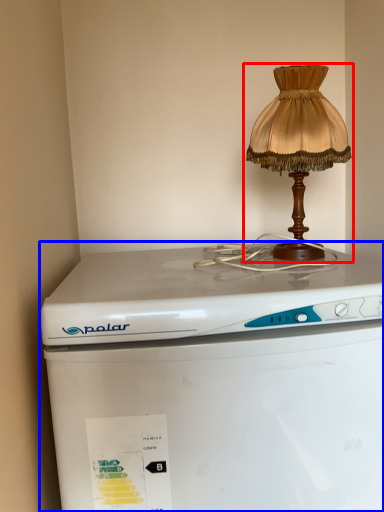
Question: Which object is closer to the camera taking this photo, lamp (highlighted by a red box) or home appliance (highlighted by a blue box)?

Choices:
 (A) lamp
 (B) home appliance

Answer: (B)